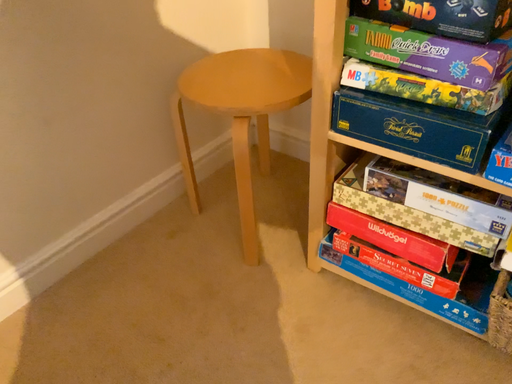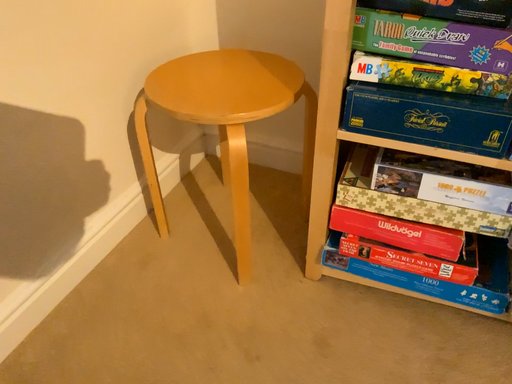
Question: Which way did the camera rotate in the video?

Choices:
 (A) rotated right
 (B) rotated left

Answer: (A)